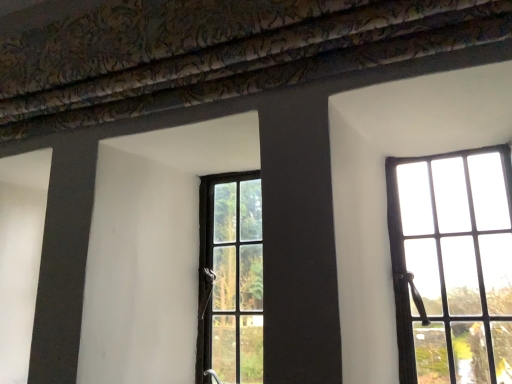
The image size is (512, 384). What do you see at coordinates (453, 264) in the screenshot?
I see `matte black window at right, placed as the first window when sorted from right to left` at bounding box center [453, 264].

This screenshot has width=512, height=384. Find the location of `matte black window at right, positioned as the second window in left-to-right order`. matte black window at right, positioned as the second window in left-to-right order is located at coordinates (453, 264).

Identify the location of matte black window at center, the 2th window in the right-to-left sequence. (231, 278).

Describe the element at coordinates (231, 278) in the screenshot. I see `matte black window at center, the first window positioned from the left` at that location.

Measure the distance between point (220, 184) and camera.

Point (220, 184) and camera are 1.27 meters apart.

I want to click on matte black window at right, placed as the first window when sorted from right to left, so click(453, 264).

Based on the photo, is matte black window at right, placed as the first window when sorted from right to left, at the right side of matte black window at center, the first window positioned from the left?

Yes.

Does matte black window at right, positioned as the second window in left-to-right order, lie in front of matte black window at center, the 2th window in the right-to-left sequence?

That is True.

Considering the positions of points (490, 212) and (243, 210), is point (490, 212) closer to camera compared to point (243, 210)?

Yes, it is in front of point (243, 210).

From the image's perspective, which one is positioned lower, matte black window at right, positioned as the second window in left-to-right order, or matte black window at center, the first window positioned from the left?

matte black window at center, the first window positioned from the left.

From a real-world perspective, is matte black window at right, positioned as the second window in left-to-right order, located higher than matte black window at center, the 2th window in the right-to-left sequence?

Correct, in the physical world, matte black window at right, positioned as the second window in left-to-right order, is higher than matte black window at center, the 2th window in the right-to-left sequence.

Does matte black window at right, positioned as the second window in left-to-right order, have a greater width compared to matte black window at center, the first window positioned from the left?

No, matte black window at right, positioned as the second window in left-to-right order, is not wider than matte black window at center, the first window positioned from the left.

Considering the sizes of objects matte black window at right, positioned as the second window in left-to-right order, and matte black window at center, the 2th window in the right-to-left sequence, in the image provided, who is shorter, matte black window at right, positioned as the second window in left-to-right order, or matte black window at center, the 2th window in the right-to-left sequence,?

Standing shorter between the two is matte black window at right, positioned as the second window in left-to-right order.

Which of these two, matte black window at right, placed as the first window when sorted from right to left, or matte black window at center, the first window positioned from the left, is smaller?

With smaller size is matte black window at center, the first window positioned from the left.

Would you say matte black window at right, positioned as the second window in left-to-right order, contains matte black window at center, the first window positioned from the left?

Result: No, matte black window at center, the first window positioned from the left, is not inside matte black window at right, positioned as the second window in left-to-right order.

Is matte black window at right, positioned as the second window in left-to-right order, placed right next to matte black window at center, the 2th window in the right-to-left sequence?

matte black window at right, positioned as the second window in left-to-right order, and matte black window at center, the 2th window in the right-to-left sequence, are not in contact.

Consider the image. Is matte black window at right, placed as the first window when sorted from right to left, oriented away from matte black window at center, the first window positioned from the left?

No.

Identify the location of window below the matte black window at right, placed as the first window when sorted from right to left (from a real-world perspective). This screenshot has height=384, width=512. (231, 278).

Can you confirm if matte black window at center, the first window positioned from the left, is positioned to the right of matte black window at right, positioned as the second window in left-to-right order?

No, matte black window at center, the first window positioned from the left, is not to the right of matte black window at right, positioned as the second window in left-to-right order.

Is matte black window at center, the 2th window in the right-to-left sequence, in front of or behind matte black window at right, placed as the first window when sorted from right to left, in the image?

In the image, matte black window at center, the 2th window in the right-to-left sequence, appears behind matte black window at right, placed as the first window when sorted from right to left.

Is point (215, 226) closer or farther from the camera than point (397, 332)?

Clearly, point (215, 226) is more distant from the camera than point (397, 332).

From the image's perspective, would you say matte black window at center, the first window positioned from the left, is shown under matte black window at right, placed as the first window when sorted from right to left?

Indeed, from the image's perspective, matte black window at center, the first window positioned from the left, is shown beneath matte black window at right, placed as the first window when sorted from right to left.

From a real-world perspective, is matte black window at center, the 2th window in the right-to-left sequence, located beneath matte black window at right, positioned as the second window in left-to-right order?

Yes, from a real-world perspective, matte black window at center, the 2th window in the right-to-left sequence, is under matte black window at right, positioned as the second window in left-to-right order.

Can you confirm if matte black window at center, the 2th window in the right-to-left sequence, is thinner than matte black window at right, placed as the first window when sorted from right to left?

No.

Does matte black window at center, the 2th window in the right-to-left sequence, have a lesser height compared to matte black window at right, placed as the first window when sorted from right to left?

Incorrect, the height of matte black window at center, the 2th window in the right-to-left sequence, does not fall short of that of matte black window at right, placed as the first window when sorted from right to left.

Which of these two, matte black window at center, the 2th window in the right-to-left sequence, or matte black window at right, positioned as the second window in left-to-right order, is bigger?

matte black window at right, positioned as the second window in left-to-right order, is bigger.

Is matte black window at right, positioned as the second window in left-to-right order, located within matte black window at center, the first window positioned from the left?

Actually, matte black window at right, positioned as the second window in left-to-right order, is outside matte black window at center, the first window positioned from the left.

Consider the image. Would you consider matte black window at center, the first window positioned from the left, to be distant from matte black window at right, positioned as the second window in left-to-right order?

No, matte black window at center, the first window positioned from the left, is in close proximity to matte black window at right, positioned as the second window in left-to-right order.

Is matte black window at center, the 2th window in the right-to-left sequence, turned away from matte black window at right, positioned as the second window in left-to-right order?

matte black window at center, the 2th window in the right-to-left sequence, is not turned away from matte black window at right, positioned as the second window in left-to-right order.

In the image, there is a matte black window at right, placed as the first window when sorted from right to left. Identify the location of window below it (from a real-world perspective). Image resolution: width=512 pixels, height=384 pixels. (231, 278).

I want to click on window that appears above the matte black window at center, the first window positioned from the left (from the image's perspective), so click(x=453, y=264).

What are the coordinates of `window lying behind the matte black window at right, placed as the first window when sorted from right to left` in the screenshot? It's located at (231, 278).